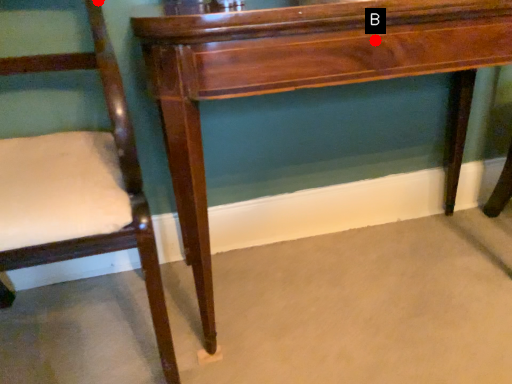
Question: Two points are circled on the image, labeled by A and B beside each circle. Which point is farther from the camera taking this photo?

Choices:
 (A) A is further
 (B) B is further

Answer: (A)